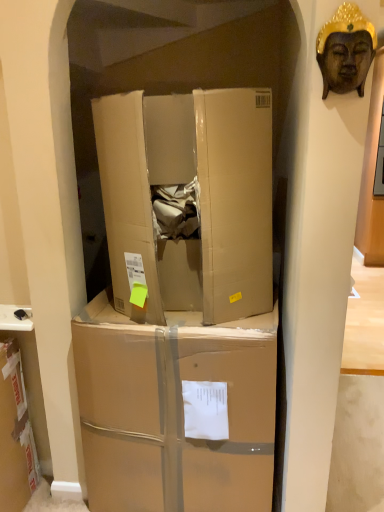
Question: Can you confirm if brown cardboard box at center, arranged as the first box when ordered from the bottom, is taller than cardboard box at center, the 1th box in the top-to-bottom sequence?

Choices:
 (A) yes
 (B) no

Answer: (A)

Question: Is brown cardboard box at center, the 2th box positioned from the top, oriented away from cardboard box at center, the 1th box in the top-to-bottom sequence?

Choices:
 (A) no
 (B) yes

Answer: (A)

Question: Is cardboard box at center, the 1th box in the top-to-bottom sequence, completely or partially inside brown cardboard box at center, arranged as the first box when ordered from the bottom?

Choices:
 (A) no
 (B) yes

Answer: (A)

Question: Is brown cardboard box at center, the 2th box positioned from the top, to the left of cardboard box at center, which is counted as the second box, starting from the bottom, from the viewer's perspective?

Choices:
 (A) yes
 (B) no

Answer: (A)

Question: From the image's perspective, is brown cardboard box at center, the 2th box positioned from the top, under cardboard box at center, which is counted as the second box, starting from the bottom?

Choices:
 (A) yes
 (B) no

Answer: (A)

Question: From a real-world perspective, relative to brown cardboard box at center, the 2th box positioned from the top, is cardboard box at center, the 1th box in the top-to-bottom sequence, vertically above or below?

Choices:
 (A) above
 (B) below

Answer: (A)

Question: Considering the positions of point (205, 117) and point (195, 464), is point (205, 117) closer or farther from the camera than point (195, 464)?

Choices:
 (A) closer
 (B) farther

Answer: (A)

Question: From their relative heights in the image, would you say cardboard box at center, the 1th box in the top-to-bottom sequence, is taller or shorter than brown cardboard box at center, arranged as the first box when ordered from the bottom?

Choices:
 (A) short
 (B) tall

Answer: (A)

Question: Is cardboard box at center, the 1th box in the top-to-bottom sequence, spatially inside brown cardboard box at center, arranged as the first box when ordered from the bottom, or outside of it?

Choices:
 (A) outside
 (B) inside

Answer: (A)

Question: Is point (105, 159) closer or farther from the camera than point (350, 49)?

Choices:
 (A) closer
 (B) farther

Answer: (B)

Question: Based on their sizes in the image, would you say cardboard box at center, the 1th box in the top-to-bottom sequence, is bigger or smaller than wooden buddha head at upper right?

Choices:
 (A) small
 (B) big

Answer: (B)

Question: From a real-world perspective, is cardboard box at center, the 1th box in the top-to-bottom sequence, above or below wooden buddha head at upper right?

Choices:
 (A) above
 (B) below

Answer: (B)

Question: Considering the positions of cardboard box at center, which is counted as the second box, starting from the bottom, and wooden buddha head at upper right in the image, is cardboard box at center, which is counted as the second box, starting from the bottom, wider or thinner than wooden buddha head at upper right?

Choices:
 (A) thin
 (B) wide

Answer: (B)

Question: In terms of width, does brown cardboard box at center, arranged as the first box when ordered from the bottom, look wider or thinner when compared to wooden buddha head at upper right?

Choices:
 (A) wide
 (B) thin

Answer: (A)

Question: In terms of height, does brown cardboard box at center, arranged as the first box when ordered from the bottom, look taller or shorter compared to wooden buddha head at upper right?

Choices:
 (A) tall
 (B) short

Answer: (A)